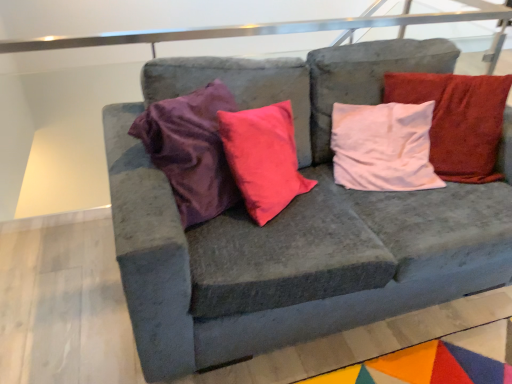
Question: Is velvet gray couch at center situated inside multicolored felt mat at lower right or outside?

Choices:
 (A) outside
 (B) inside

Answer: (A)

Question: Considering their positions, is velvet gray couch at center located in front of or behind multicolored felt mat at lower right?

Choices:
 (A) behind
 (B) front

Answer: (B)

Question: Which of these objects is positioned closest to the velvet gray couch at center?

Choices:
 (A) white soft pillow at upper right
 (B) multicolored felt mat at lower right

Answer: (A)

Question: Estimate the real-world distances between objects in this image. Which object is closer to the velvet gray couch at center?

Choices:
 (A) multicolored felt mat at lower right
 (B) white soft pillow at upper right

Answer: (B)